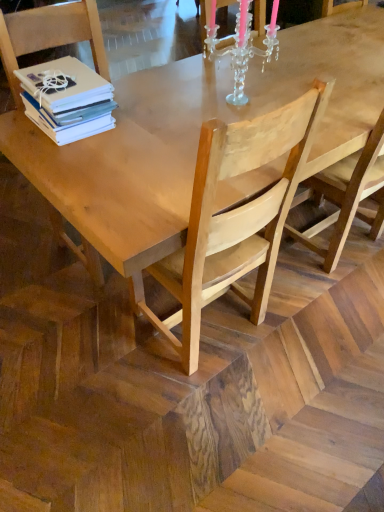
Question: In which direction should I rotate to look at clear crystal candle holder at upper center?

Choices:
 (A) right
 (B) left

Answer: (A)

Question: Considering the relative sizes of light brown wooden chair at center, the 1th chair positioned from the right, and white matte stack of books at upper left in the image provided, is light brown wooden chair at center, the 1th chair positioned from the right, smaller than white matte stack of books at upper left?

Choices:
 (A) no
 (B) yes

Answer: (A)

Question: Considering the relative positions of light brown wooden chair at center, acting as the 2th chair starting from the left, and white matte stack of books at upper left in the image provided, is light brown wooden chair at center, acting as the 2th chair starting from the left, behind white matte stack of books at upper left?

Choices:
 (A) no
 (B) yes

Answer: (A)

Question: Can you confirm if light brown wooden chair at center, acting as the 2th chair starting from the left, is bigger than white matte stack of books at upper left?

Choices:
 (A) yes
 (B) no

Answer: (A)

Question: Can you confirm if light brown wooden chair at center, acting as the 2th chair starting from the left, is wider than white matte stack of books at upper left?

Choices:
 (A) yes
 (B) no

Answer: (A)

Question: Is light brown wooden chair at center, acting as the 2th chair starting from the left, far from white matte stack of books at upper left?

Choices:
 (A) no
 (B) yes

Answer: (A)

Question: From a real-world perspective, is light brown wooden chair at center, the 1th chair positioned from the right, positioned under white matte stack of books at upper left based on gravity?

Choices:
 (A) yes
 (B) no

Answer: (A)

Question: From the image's perspective, does white matte stack of books at upper left appear lower than light brown wooden chair at center, acting as the 2th chair starting from the left?

Choices:
 (A) yes
 (B) no

Answer: (B)

Question: Is white matte stack of books at upper left not inside light brown wooden chair at center, the 1th chair positioned from the right?

Choices:
 (A) no
 (B) yes

Answer: (B)

Question: Considering the relative sizes of white matte stack of books at upper left and light brown wooden chair at center, the 1th chair positioned from the right, in the image provided, is white matte stack of books at upper left thinner than light brown wooden chair at center, the 1th chair positioned from the right,?

Choices:
 (A) no
 (B) yes

Answer: (B)

Question: Is white matte stack of books at upper left far from light brown wooden chair at center, the 1th chair positioned from the right?

Choices:
 (A) no
 (B) yes

Answer: (A)

Question: From the image's perspective, is white matte stack of books at upper left on top of light brown wooden chair at center, acting as the 2th chair starting from the left?

Choices:
 (A) no
 (B) yes

Answer: (B)

Question: Is the position of white matte stack of books at upper left more distant than that of light brown wooden chair at center, the 1th chair positioned from the right?

Choices:
 (A) yes
 (B) no

Answer: (A)

Question: Would you say white matte stack of books at upper left is outside light brown wood chair at left, arranged as the 1th chair when viewed from the left?

Choices:
 (A) yes
 (B) no

Answer: (B)